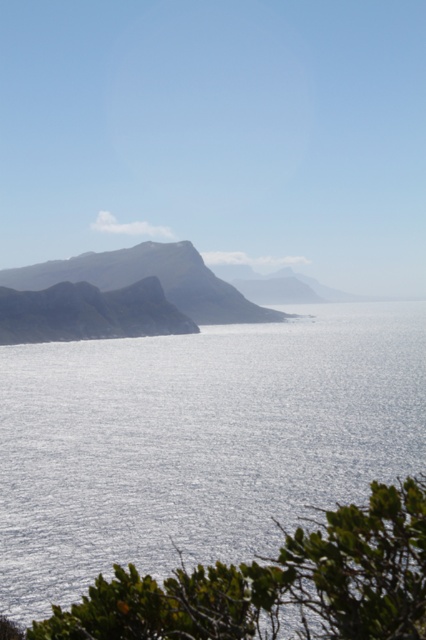
Does glistening silver water at center lie behind smooth gray rock at center?

That is False.

Is glistening silver water at center shorter than smooth gray rock at center?

Correct, glistening silver water at center is not as tall as smooth gray rock at center.

At what (x,y) coordinates should I click in order to perform the action: click on glistening silver water at center. Please return your answer as a coordinate pair (x, y). Image resolution: width=426 pixels, height=640 pixels. Looking at the image, I should click on (196, 436).

Who is more distant from viewer, (215, 536) or (350, 588)?

Point (215, 536)

Does glistening silver water at center have a lesser width compared to green leafy shrub at lower right?

No, glistening silver water at center is not thinner than green leafy shrub at lower right.

Identify the location of glistening silver water at center. The height and width of the screenshot is (640, 426). (196, 436).

Does green leafy shrub at lower right appear under smooth gray rock at center?

Correct, green leafy shrub at lower right is located below smooth gray rock at center.

Is green leafy shrub at lower right wider than smooth gray rock at center?

No, green leafy shrub at lower right is not wider than smooth gray rock at center.

Find the location of a particular element. The image size is (426, 640). green leafy shrub at lower right is located at coordinates (278, 584).